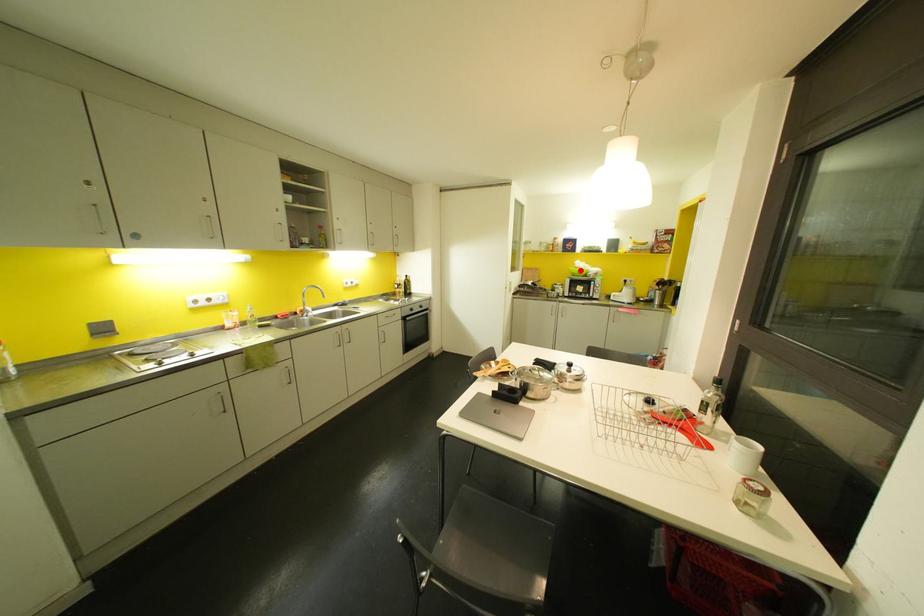
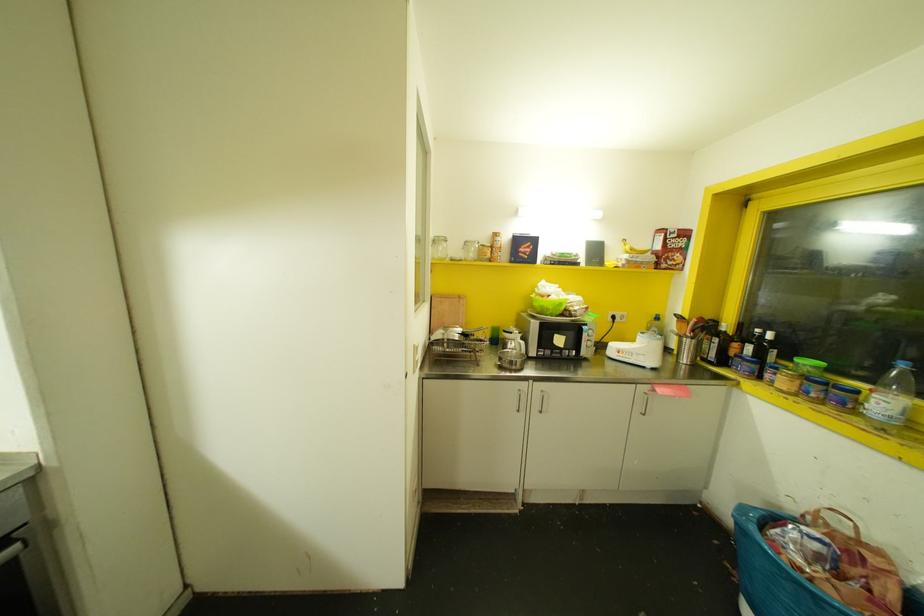
In the second image, find the point that corresponds to the highlighted location in the first image.

(560, 304)